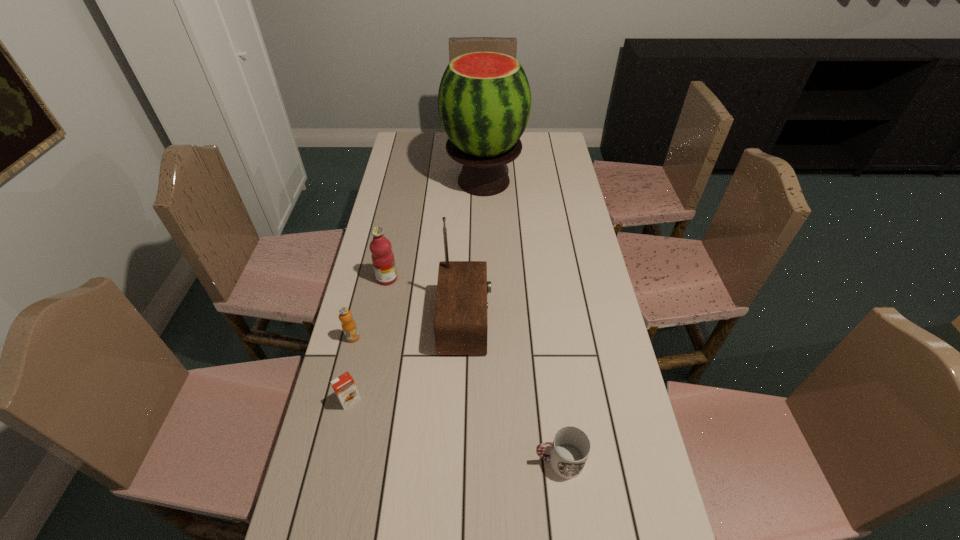
Where is `the tallest object`? The width and height of the screenshot is (960, 540). the tallest object is located at coordinates (484, 100).

The width and height of the screenshot is (960, 540). What are the coordinates of `the farthest object` in the screenshot? It's located at (484, 100).

Identify the location of the fifth shortest object. (460, 321).

The width and height of the screenshot is (960, 540). In order to click on fruit juice in this screenshot , I will do `click(382, 256)`.

Find the location of a particular element. This screenshot has width=960, height=540. the second farthest object is located at coordinates point(382,256).

Find the location of a particular element. Image resolution: width=960 pixels, height=540 pixels. the taller orange juice is located at coordinates (348, 325).

This screenshot has height=540, width=960. Find the location of `the third shortest object`. the third shortest object is located at coordinates (348, 325).

This screenshot has height=540, width=960. Find the location of `the nearer orange juice`. the nearer orange juice is located at coordinates (344, 386).

The width and height of the screenshot is (960, 540). Identify the location of the shorter orange juice. (344, 386).

The height and width of the screenshot is (540, 960). Find the location of `cup`. cup is located at coordinates (571, 446).